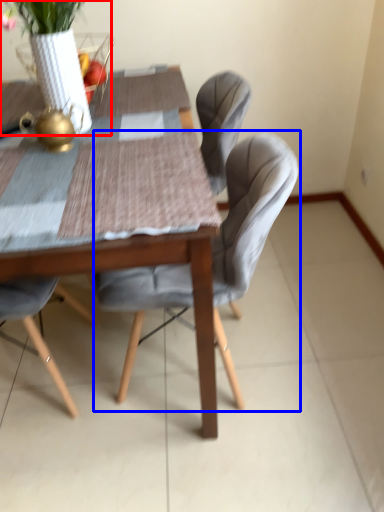
Question: Which point is closer to the camera, floral arrangement (highlighted by a red box) or chair (highlighted by a blue box)?

Choices:
 (A) floral arrangement
 (B) chair

Answer: (A)